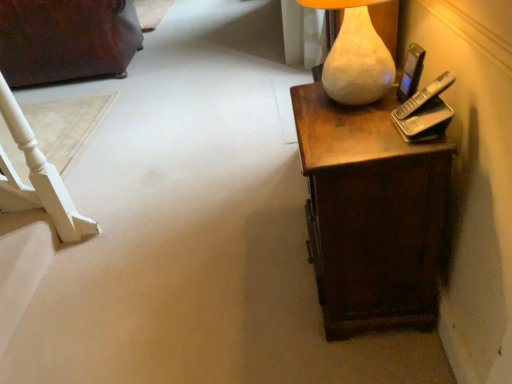
At what (x,y) coordinates should I click in order to perform the action: click on empty space that is in between dark brown wood dresser at upper left and brown wood desk at right. Please return your answer as a coordinate pair (x, y). The height and width of the screenshot is (384, 512). Looking at the image, I should click on (166, 143).